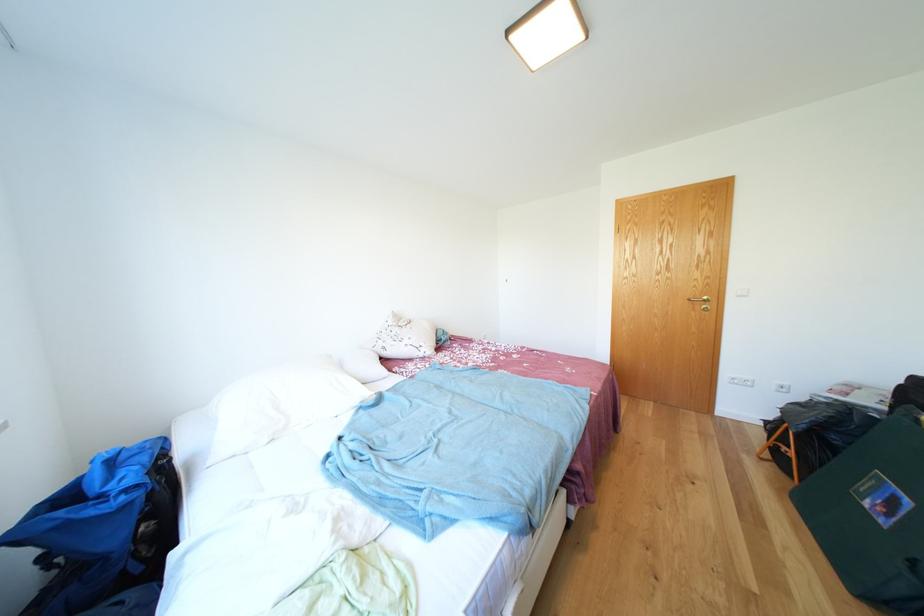
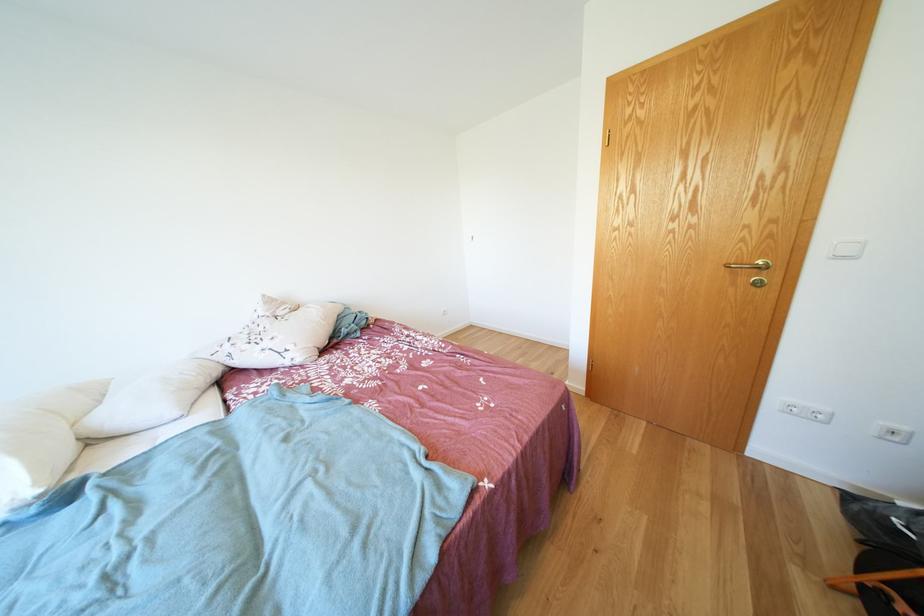
The images are taken continuously from a first-person perspective. In which direction are you moving?

The cameraman walked toward right, forward.